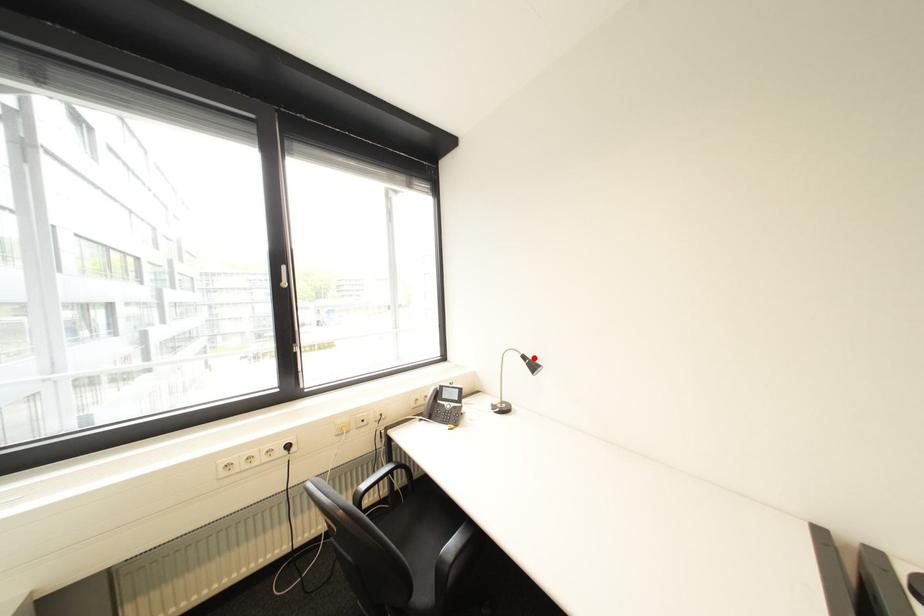
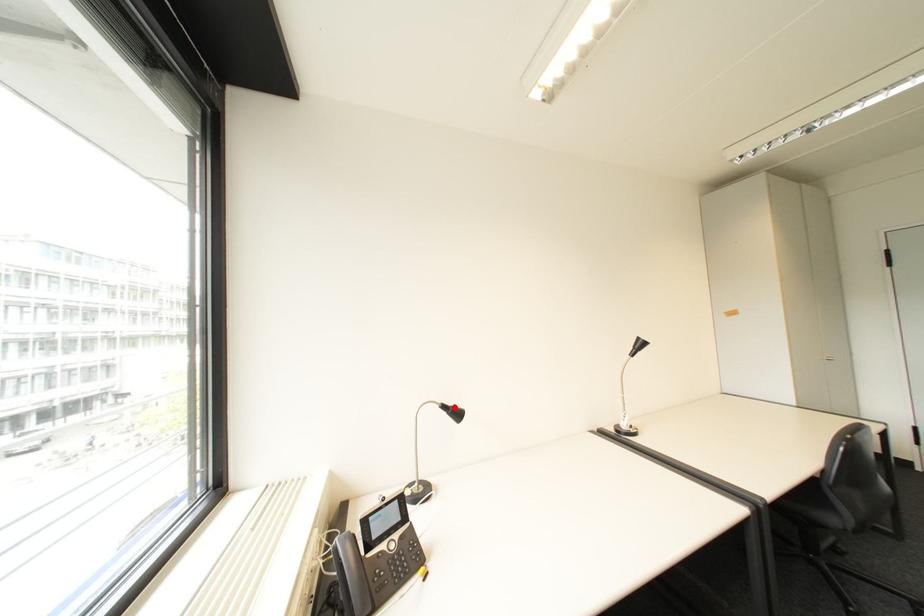
I am providing you with two images of the same scene from different viewpoints. A red point is marked on the first image and another point is marked on the second image. Are the points marked in image1 and image2 representing the same 3D position?

Yes